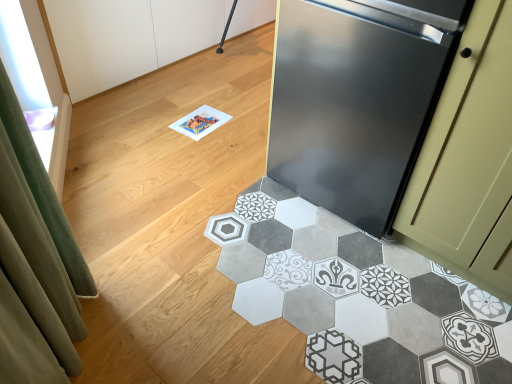
This screenshot has width=512, height=384. In order to click on blank space above patterned tile floor at lower right (from a real-world perspective) in this screenshot , I will do `click(264, 323)`.